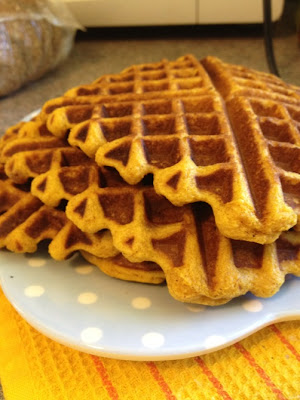
Identify the location of dark flooring. The width and height of the screenshot is (300, 400). click(x=122, y=54), click(x=238, y=53).